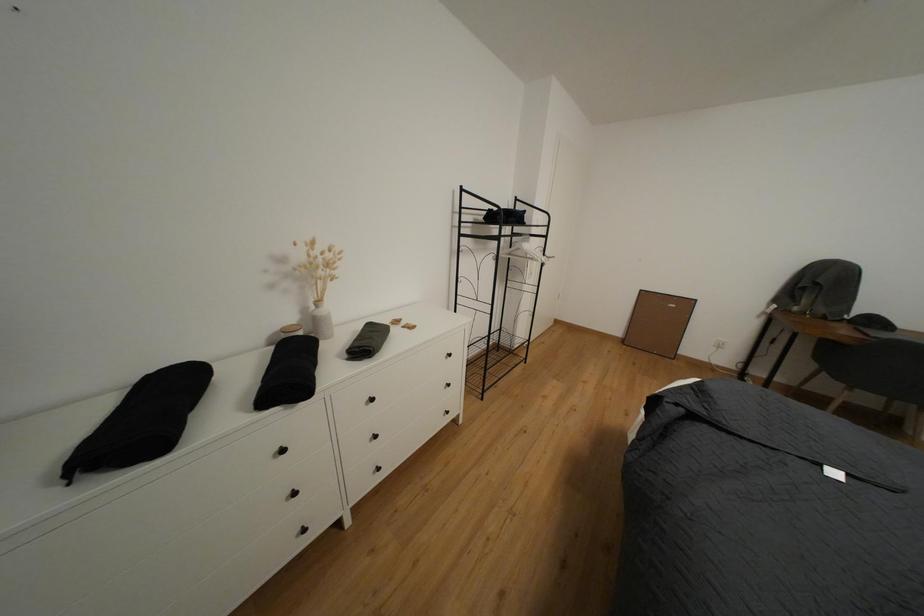
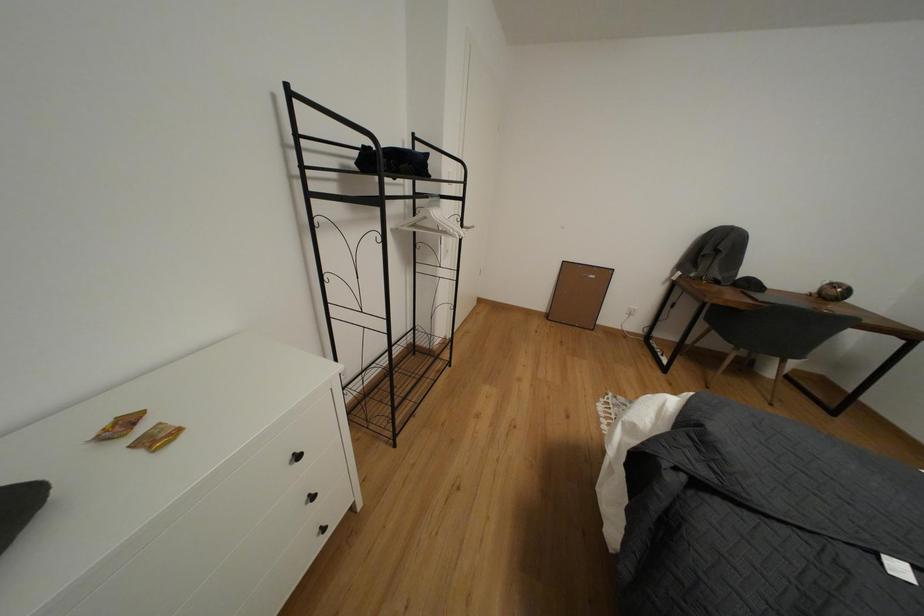
Question: In a continuous first-person perspective shot, in which direction is the camera moving?

Choices:
 (A) Left
 (B) Right
 (C) Forward
 (D) Backward

Answer: (C)